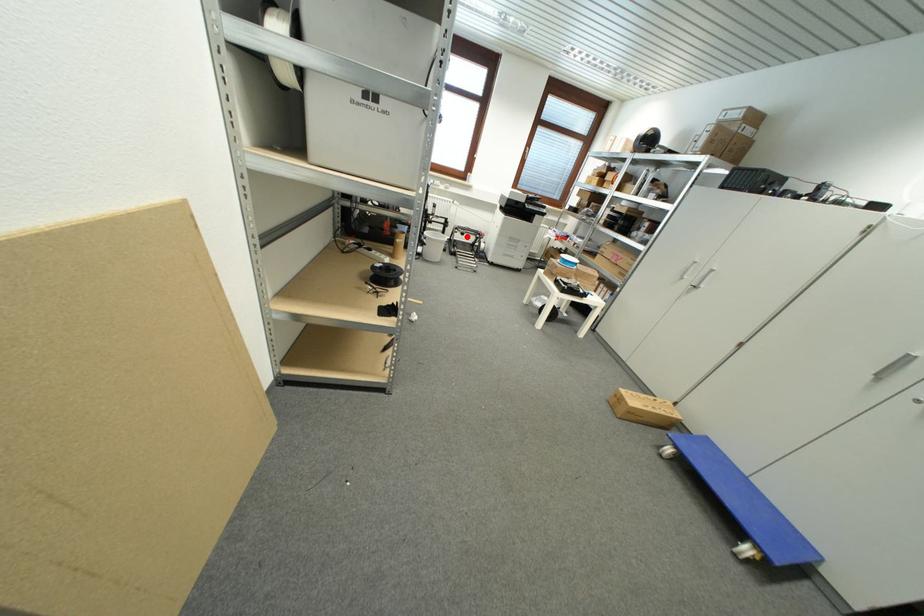
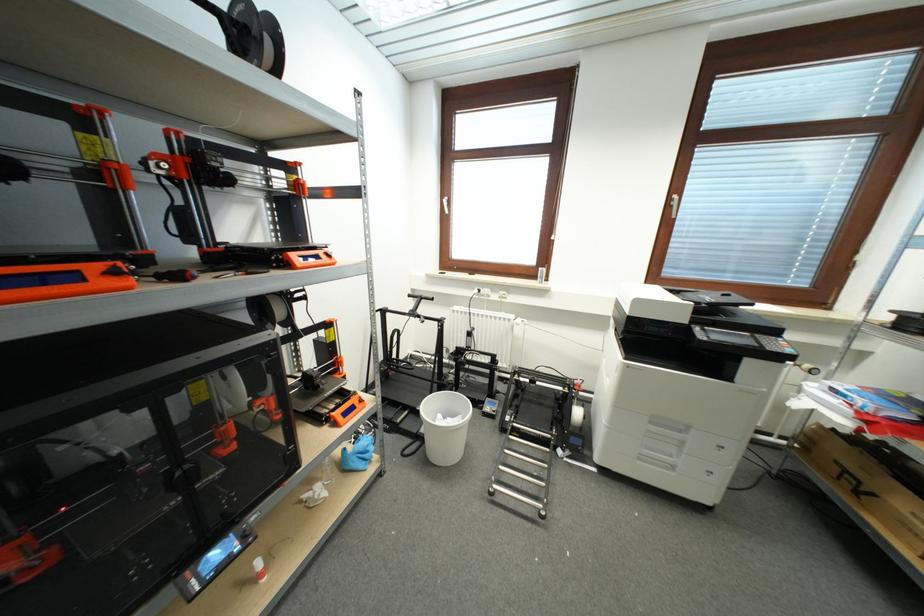
The point at the highlighted location is marked in the first image. Where is the corresponding point in the second image?

(537, 384)